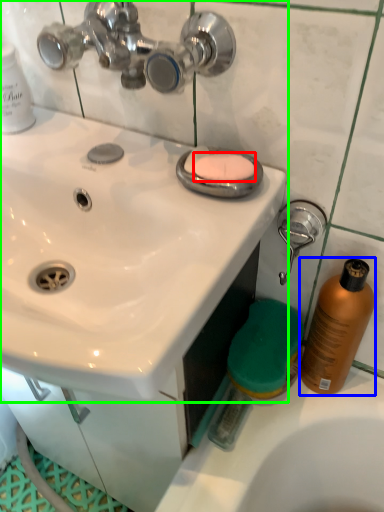
Question: Considering the real-world distances, which object is farthest from soap (highlighted by a red box)? cleaning product (highlighted by a blue box) or sink (highlighted by a green box)?

Choices:
 (A) cleaning product
 (B) sink

Answer: (A)